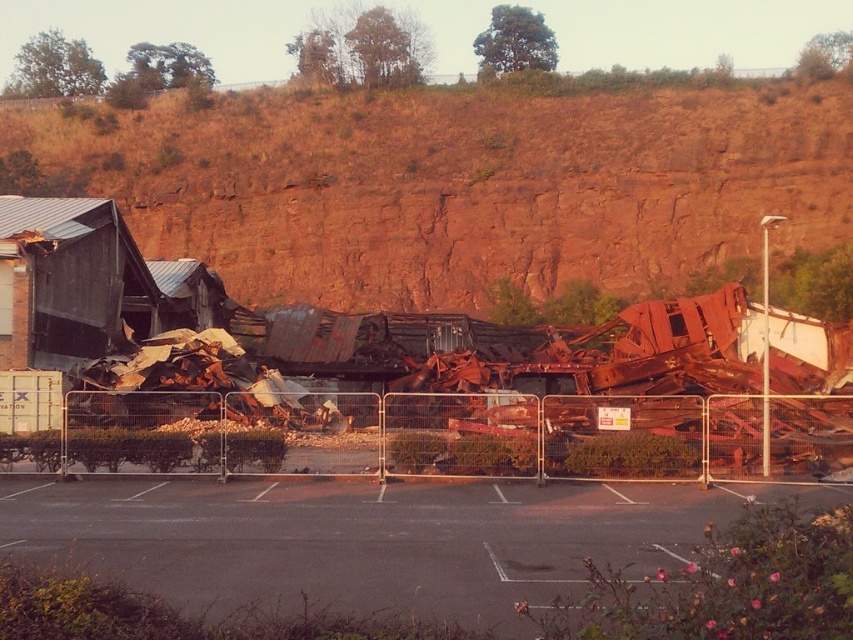
You are a construction worker assessing the site. You see the rusty metal hillside at upper center and the dark asphalt parking lot at center. Which object is positioned higher relative to the other?

The rusty metal hillside at upper center is above the dark asphalt parking lot at center, so it is positioned higher.

You are standing at the entrance of the parking lot and want to reach the rusty metal hillside at upper center. According to the coordinates provided, in which direction should you move from your current position to reach it?

The rusty metal hillside at upper center is located at coordinates point (461,186), so you should move towards the upper center direction from your current position in the parking lot to reach it.

You are a construction worker assessing the site. You need to determine if the rusty metal hillside at upper center is wider than the dark asphalt parking lot at center. Based on the scene, what can you conclude?

The rusty metal hillside at upper center is wider than the dark asphalt parking lot at center according to the description.